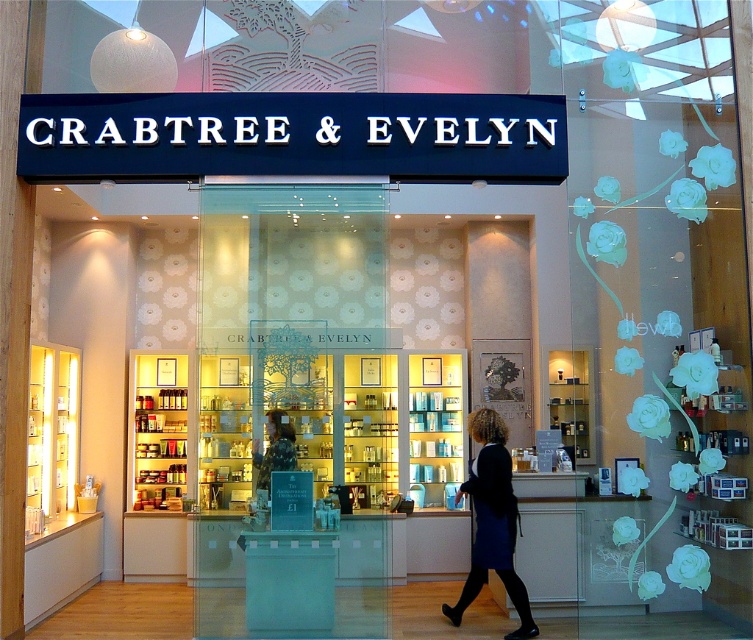
Question: Is dark blue dress at center above matte black statue at center?

Choices:
 (A) no
 (B) yes

Answer: (A)

Question: Is dark blue dress at center bigger than matte black statue at center?

Choices:
 (A) yes
 (B) no

Answer: (A)

Question: Which point is closer to the camera?

Choices:
 (A) dark blue dress at center
 (B) matte black statue at center

Answer: (B)

Question: Among these points, which one is farthest from the camera?

Choices:
 (A) (492, 460)
 (B) (255, 452)

Answer: (A)

Question: From the image, what is the correct spatial relationship of dark blue dress at center in relation to matte black statue at center?

Choices:
 (A) above
 (B) below

Answer: (B)